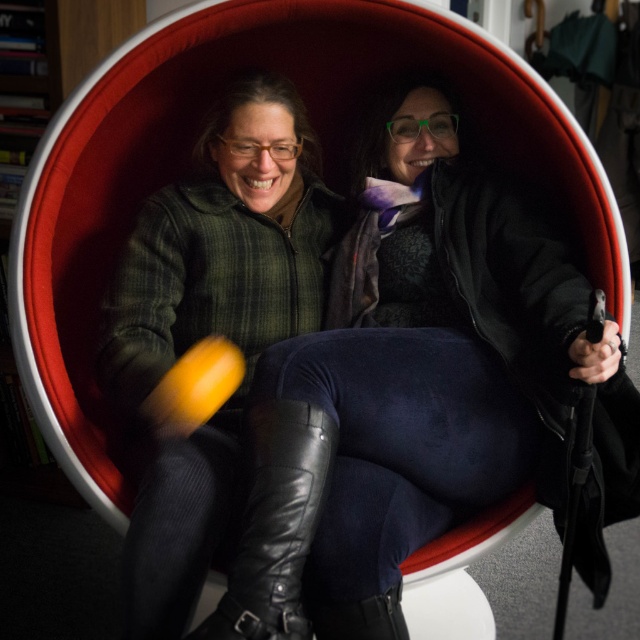
You are a photographer trying to capture a clear photo of the green plaid jacket at left and the black leather boot at center. The camera has a focus range of 10 inches. Will the camera be able to focus on both objects simultaneously?

The green plaid jacket at left and black leather boot at center are 11.02 inches apart from each other. Since the camera can only focus within a 10 inch range, the distance between them exceeds the focus range. Therefore, the camera cannot focus on both objects simultaneously.

You are designing a new coat rack and need to know the relative sizes of the items in the image. Which object is wider, the green plaid jacket at left or the black leather boot at center?

The green plaid jacket at left is wider than the black leather boot at center according to the description.